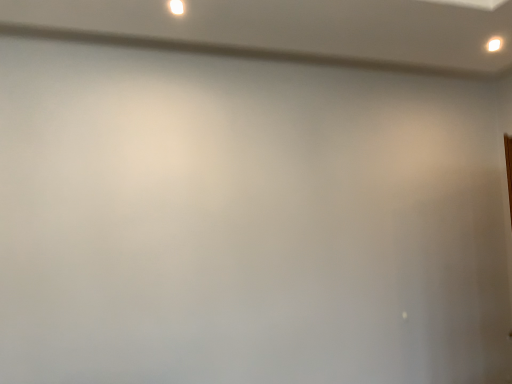
Question: From the image's perspective, is white glossy light at upper right, the first light positioned from the back, above white glossy light at upper center, which is counted as the first light, starting from the front?

Choices:
 (A) yes
 (B) no

Answer: (B)

Question: Is white glossy light at upper right, the first light from the right, positioned in front of white glossy light at upper center, placed as the 2th light when sorted from back to front?

Choices:
 (A) yes
 (B) no

Answer: (B)

Question: Does white glossy light at upper right, which appears as the second light when viewed from the front, appear on the right side of white glossy light at upper center, which appears as the first light when viewed from the left?

Choices:
 (A) no
 (B) yes

Answer: (B)

Question: Is white glossy light at upper right, which ranks as the 2th light in left-to-right order, at the left side of white glossy light at upper center, placed as the 2th light when sorted from back to front?

Choices:
 (A) yes
 (B) no

Answer: (B)

Question: Is white glossy light at upper right, the first light positioned from the back, not inside white glossy light at upper center, the second light viewed from the right?

Choices:
 (A) yes
 (B) no

Answer: (A)

Question: From the image's perspective, does white glossy light at upper right, the first light from the right, appear lower than white glossy light at upper center, which appears as the first light when viewed from the left?

Choices:
 (A) yes
 (B) no

Answer: (A)

Question: Is white glossy light at upper center, the second light viewed from the right, to the left of white glossy light at upper right, which ranks as the 2th light in left-to-right order, from the viewer's perspective?

Choices:
 (A) no
 (B) yes

Answer: (B)

Question: Is white glossy light at upper center, the second light viewed from the right, further to the viewer compared to white glossy light at upper right, the first light positioned from the back?

Choices:
 (A) yes
 (B) no

Answer: (B)

Question: Is white glossy light at upper center, placed as the 2th light when sorted from back to front, placed right next to white glossy light at upper right, which appears as the second light when viewed from the front?

Choices:
 (A) yes
 (B) no

Answer: (B)

Question: Is white glossy light at upper center, which is counted as the first light, starting from the front, far away from white glossy light at upper right, the first light from the right?

Choices:
 (A) no
 (B) yes

Answer: (B)

Question: From a real-world perspective, does white glossy light at upper center, which is counted as the first light, starting from the front, sit lower than white glossy light at upper right, the first light from the right?

Choices:
 (A) yes
 (B) no

Answer: (B)

Question: Considering the relative sizes of white glossy light at upper center, which appears as the first light when viewed from the left, and white glossy light at upper right, which appears as the second light when viewed from the front, in the image provided, is white glossy light at upper center, which appears as the first light when viewed from the left, taller than white glossy light at upper right, which appears as the second light when viewed from the front,?

Choices:
 (A) yes
 (B) no

Answer: (B)

Question: From a real-world perspective, is white glossy light at upper right, the first light from the right, above or below white glossy light at upper center, the second light viewed from the right?

Choices:
 (A) above
 (B) below

Answer: (B)